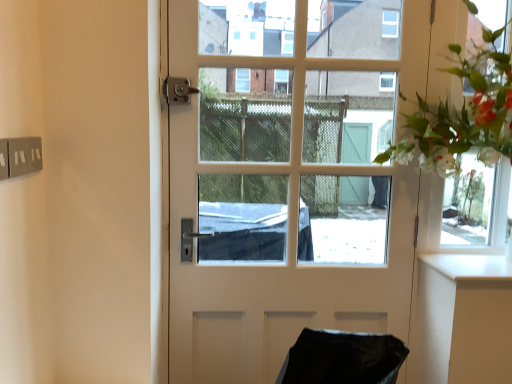
Question: From a real-world perspective, is white glossy counter top at right located beneath clear glass window frame at upper right?

Choices:
 (A) yes
 (B) no

Answer: (A)

Question: Does white glossy counter top at right come in front of clear glass window frame at upper right?

Choices:
 (A) no
 (B) yes

Answer: (B)

Question: Is white glossy counter top at right taller than clear glass window frame at upper right?

Choices:
 (A) no
 (B) yes

Answer: (A)

Question: Can you confirm if white glossy counter top at right is shorter than clear glass window frame at upper right?

Choices:
 (A) yes
 (B) no

Answer: (A)

Question: From a real-world perspective, is white glossy counter top at right physically above clear glass window frame at upper right?

Choices:
 (A) yes
 (B) no

Answer: (B)

Question: From the image's perspective, is clear glass window frame at upper right positioned above or below white glossy door at center?

Choices:
 (A) above
 (B) below

Answer: (A)

Question: Considering the relative positions of clear glass window frame at upper right and white glossy door at center in the image provided, is clear glass window frame at upper right to the left or to the right of white glossy door at center?

Choices:
 (A) left
 (B) right

Answer: (B)

Question: Would you say clear glass window frame at upper right is inside or outside white glossy door at center?

Choices:
 (A) outside
 (B) inside

Answer: (A)

Question: Is point (457, 46) positioned closer to the camera than point (289, 82)?

Choices:
 (A) closer
 (B) farther

Answer: (A)

Question: In terms of height, does white glossy counter top at right look taller or shorter compared to white glossy door at center?

Choices:
 (A) tall
 (B) short

Answer: (B)

Question: In terms of width, does white glossy counter top at right look wider or thinner when compared to white glossy door at center?

Choices:
 (A) wide
 (B) thin

Answer: (A)

Question: Is white glossy counter top at right bigger or smaller than white glossy door at center?

Choices:
 (A) small
 (B) big

Answer: (A)

Question: From the image's perspective, relative to white glossy door at center, is white glossy counter top at right above or below?

Choices:
 (A) below
 (B) above

Answer: (A)

Question: Is clear glass window frame at upper right spatially inside white glossy counter top at right, or outside of it?

Choices:
 (A) outside
 (B) inside

Answer: (A)

Question: Is clear glass window frame at upper right wider or thinner than white glossy counter top at right?

Choices:
 (A) thin
 (B) wide

Answer: (A)